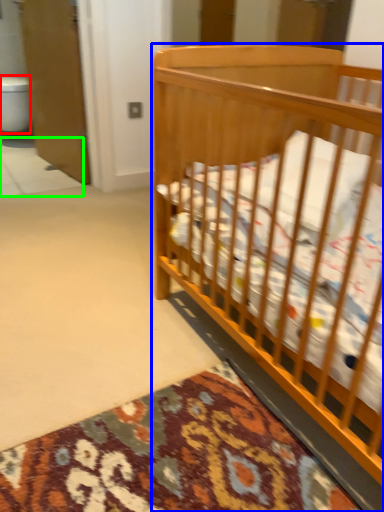
Question: Which is farther away from toilet bowl (highlighted by a red box)? infant bed (highlighted by a blue box) or tile (highlighted by a green box)?

Choices:
 (A) infant bed
 (B) tile

Answer: (A)